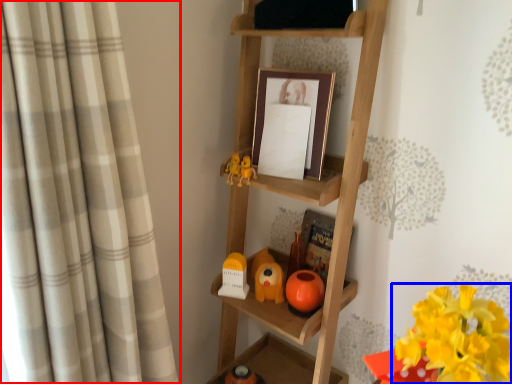
Question: Among these objects, which one is farthest to the camera, curtain (highlighted by a red box) or flower (highlighted by a blue box)?

Choices:
 (A) curtain
 (B) flower

Answer: (B)